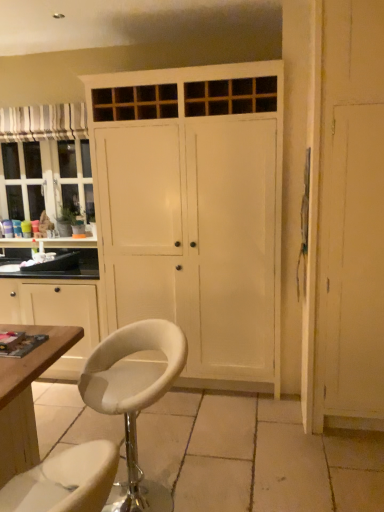
Find the location of a particular element. This screenshot has width=384, height=512. free space to the back side of white leather stool at center is located at coordinates (177, 445).